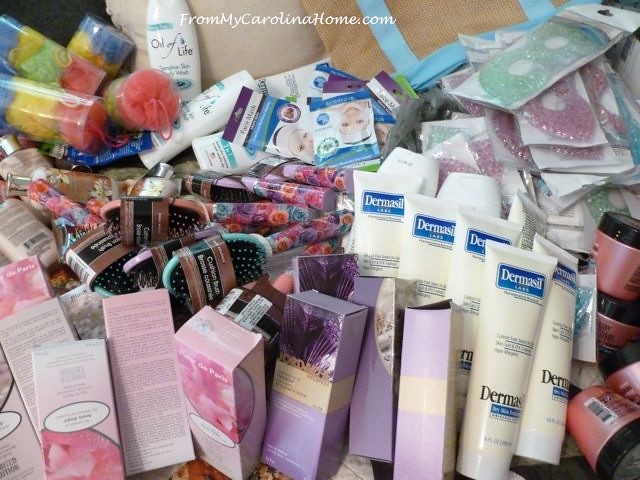
This screenshot has width=640, height=480. Find the location of `handle`. handle is located at coordinates (300, 171), (290, 191), (265, 220), (301, 234), (290, 277), (227, 234).